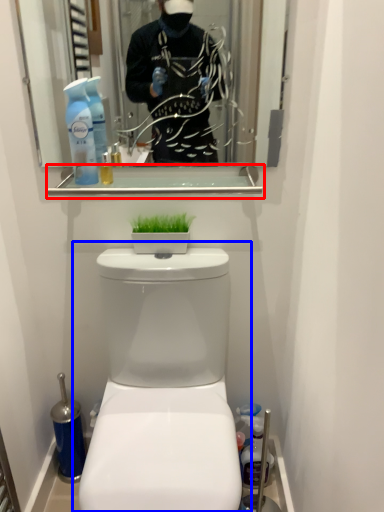
Question: Which point is further to the camera, balustrade (highlighted by a red box) or toilet (highlighted by a blue box)?

Choices:
 (A) balustrade
 (B) toilet

Answer: (A)